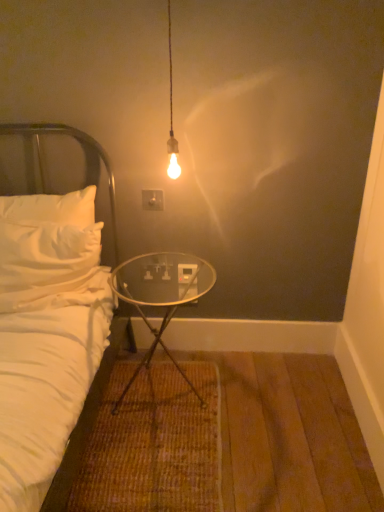
Question: Considering the relative positions of white fabric headboard at left and white plastic electric outlet at center in the image provided, is white fabric headboard at left to the left of white plastic electric outlet at center from the viewer's perspective?

Choices:
 (A) no
 (B) yes

Answer: (B)

Question: Can you confirm if white fabric headboard at left is shorter than white plastic electric outlet at center?

Choices:
 (A) yes
 (B) no

Answer: (B)

Question: From a real-world perspective, is white fabric headboard at left under white plastic electric outlet at center?

Choices:
 (A) no
 (B) yes

Answer: (B)

Question: Would you say white fabric headboard at left is a long distance from white plastic electric outlet at center?

Choices:
 (A) yes
 (B) no

Answer: (B)

Question: Is white fabric headboard at left bigger than white plastic electric outlet at center?

Choices:
 (A) yes
 (B) no

Answer: (A)

Question: Is white plastic electric outlet at center in front of or behind white fabric headboard at left in the image?

Choices:
 (A) behind
 (B) front

Answer: (A)

Question: Choose the correct answer: Is white plastic electric outlet at center inside white fabric headboard at left or outside it?

Choices:
 (A) inside
 (B) outside

Answer: (B)

Question: In terms of height, does white plastic electric outlet at center look taller or shorter compared to white fabric headboard at left?

Choices:
 (A) tall
 (B) short

Answer: (B)

Question: Is white plastic electric outlet at center bigger or smaller than white fabric headboard at left?

Choices:
 (A) big
 (B) small

Answer: (B)

Question: Considering the positions of point (117, 271) and point (150, 194), is point (117, 271) closer or farther from the camera than point (150, 194)?

Choices:
 (A) farther
 (B) closer

Answer: (A)

Question: From the image's perspective, relative to white plastic electric outlet at center, is transparent glass table at center above or below?

Choices:
 (A) below
 (B) above

Answer: (A)

Question: Looking at their shapes, would you say transparent glass table at center is wider or thinner than white plastic electric outlet at center?

Choices:
 (A) wide
 (B) thin

Answer: (A)

Question: Is transparent glass table at center bigger or smaller than white plastic electric outlet at center?

Choices:
 (A) big
 (B) small

Answer: (A)

Question: Is white fabric headboard at left in front of or behind white plastic electric outlet at center in the image?

Choices:
 (A) front
 (B) behind

Answer: (A)

Question: In terms of size, does white fabric headboard at left appear bigger or smaller than white plastic electric outlet at center?

Choices:
 (A) big
 (B) small

Answer: (A)